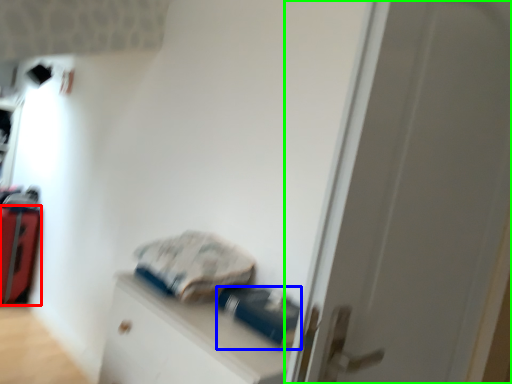
Question: Based on their relative distances, which object is nearer to luggage (highlighted by a red box)? Choose from equipment (highlighted by a blue box) and door (highlighted by a green box).

Choices:
 (A) equipment
 (B) door

Answer: (A)